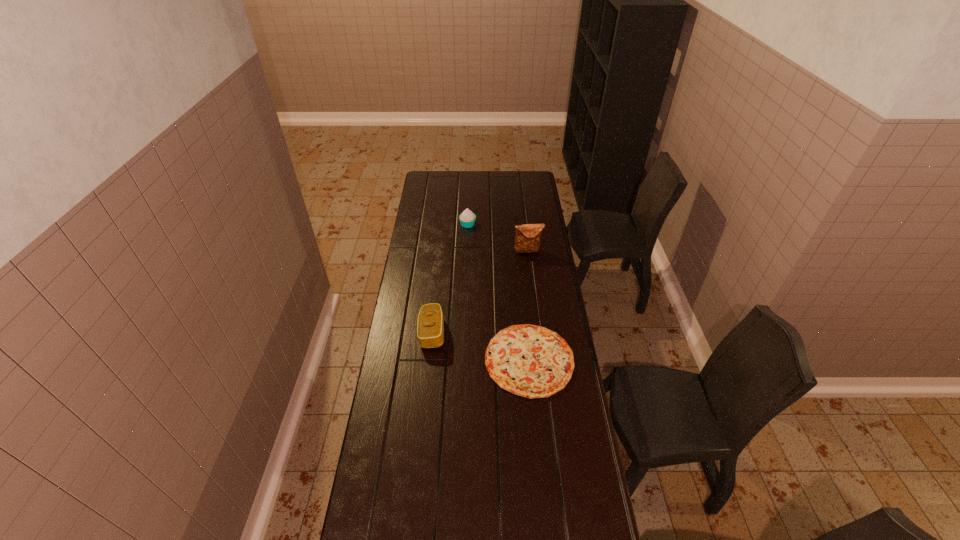
The height and width of the screenshot is (540, 960). In order to click on empty space that is in between the shortest object and the right clutch bag in this screenshot , I will do `click(529, 306)`.

Identify the location of vacant area that lies between the second farthest object and the shortest object. The image size is (960, 540). (529, 306).

This screenshot has width=960, height=540. Find the location of `free point between the leftmost object and the farther clutch bag`. free point between the leftmost object and the farther clutch bag is located at coordinates (480, 292).

Locate an element on the screen. Image resolution: width=960 pixels, height=540 pixels. vacant space that is in between the leftmost object and the second farthest object is located at coordinates (480, 292).

At what (x,y) coordinates should I click in order to perform the action: click on empty space that is in between the shorter clutch bag and the right clutch bag. Please return your answer as a coordinate pair (x, y). The width and height of the screenshot is (960, 540). Looking at the image, I should click on (480, 292).

Where is `vacant area that lies between the nearer clutch bag and the farthest object`? The height and width of the screenshot is (540, 960). vacant area that lies between the nearer clutch bag and the farthest object is located at coordinates (450, 279).

Locate an element on the screen. This screenshot has width=960, height=540. free space between the tallest object and the cupcake is located at coordinates (498, 238).

I want to click on free point between the farthest object and the pizza, so click(498, 292).

Where is `empty space that is in between the shortest object and the leftmost object`? empty space that is in between the shortest object and the leftmost object is located at coordinates click(x=481, y=346).

Identify which object is the second closest to the leftmost object. Please provide its 2D coordinates. Your answer should be formatted as a tuple, i.e. [(x, y)], where the tuple contains the x and y coordinates of a point satisfying the conditions above.

[(527, 239)]